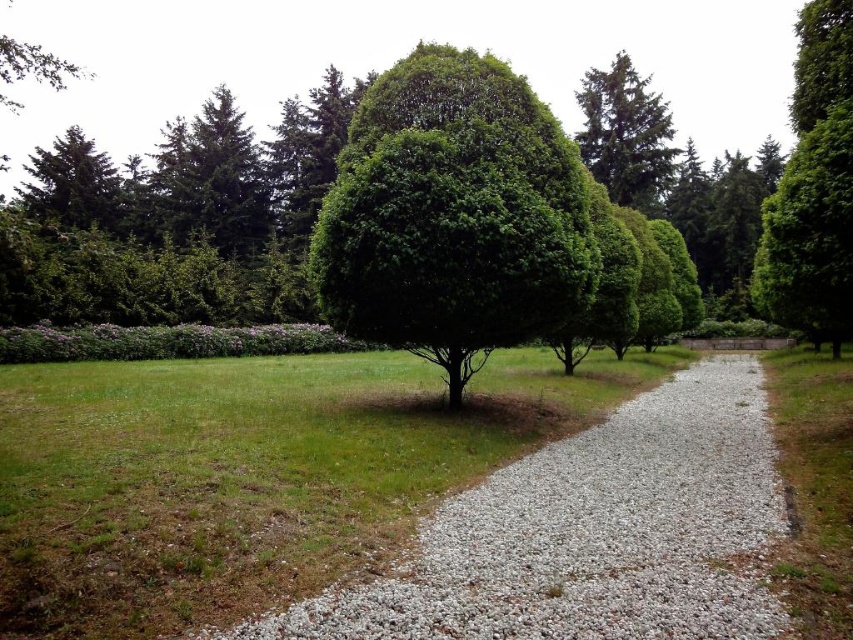
You are standing at the start of the path and want to walk to the green leafy tree at right. Which direction should you go relative to the white gravel at center?

You should walk towards the green leafy tree at right, which is located to the right of the white gravel at center. Since the white gravel at center is closer to you, you need to move forward past it and then turn right to reach the tree.